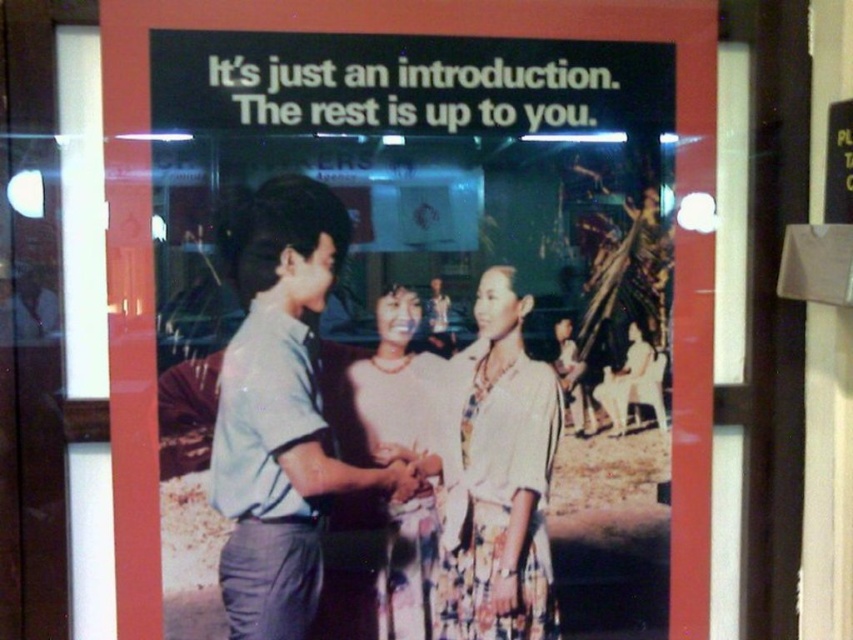
Can you confirm if light blue shirt at center is positioned above printed silk blouse at center?

Correct, light blue shirt at center is located above printed silk blouse at center.

This screenshot has width=853, height=640. What do you see at coordinates (280, 410) in the screenshot?
I see `light blue shirt at center` at bounding box center [280, 410].

At what (x,y) coordinates should I click in order to perform the action: click on light blue shirt at center. Please return your answer as a coordinate pair (x, y). This screenshot has width=853, height=640. Looking at the image, I should click on (280, 410).

Find the location of a particular element. The image size is (853, 640). printed silk blouse at center is located at coordinates (497, 477).

Can you confirm if printed silk blouse at center is wider than matte white blouse at center?

Yes.

Identify the location of printed silk blouse at center. (497, 477).

Does matte paper poster at center appear under matte white blouse at center?

Incorrect, matte paper poster at center is not positioned below matte white blouse at center.

You are a GUI agent. You are given a task and a screenshot of the screen. Output one action in this format:
    pyautogui.click(x=<x>, y=<y>)
    Task: Click on the matte paper poster at center
    This screenshot has height=640, width=853.
    Given the screenshot: What is the action you would take?
    pyautogui.click(x=312, y=32)